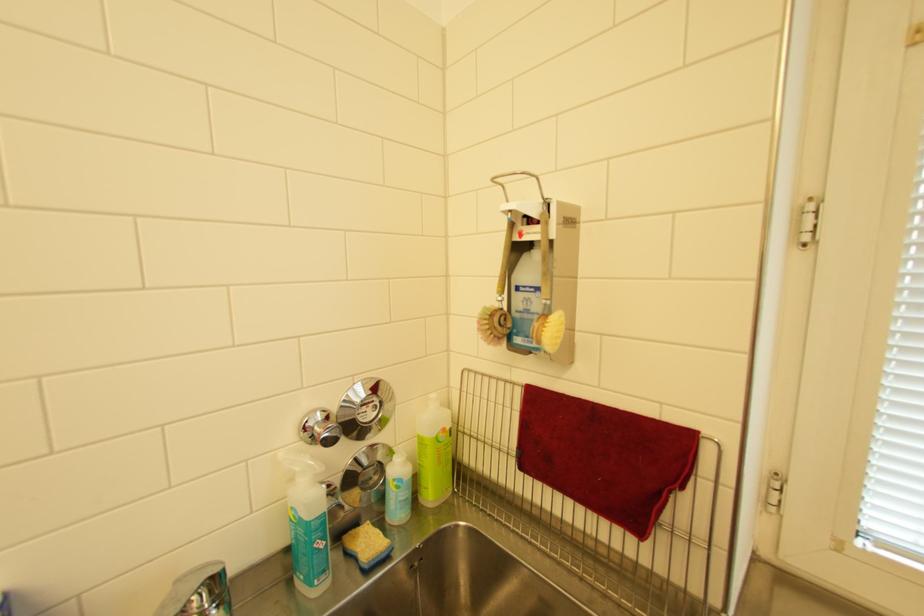
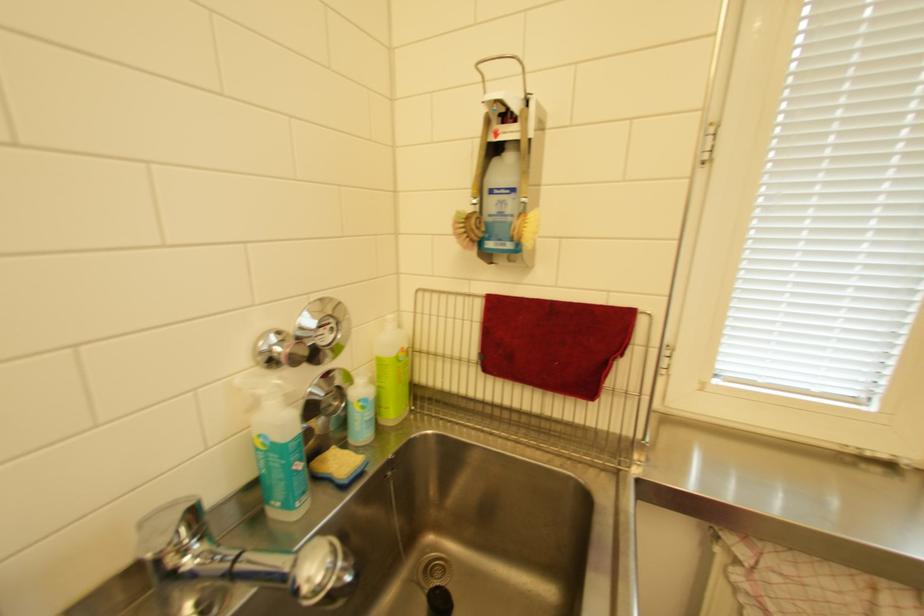
Where in the second image is the point corresponding to point (288, 455) from the first image?

(244, 379)